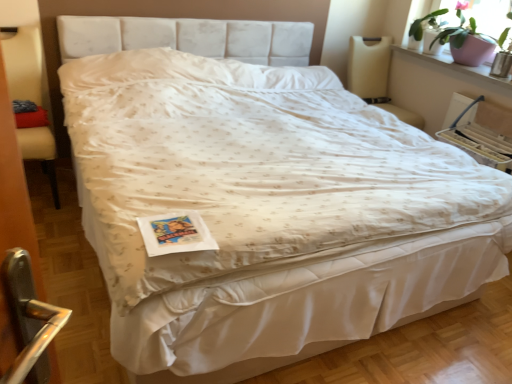
Question: Is green matte plant at upper right behind beige fabric armchair at left?

Choices:
 (A) no
 (B) yes

Answer: (B)

Question: Can you confirm if green matte plant at upper right is shorter than beige fabric armchair at left?

Choices:
 (A) no
 (B) yes

Answer: (B)

Question: Could beige fabric armchair at left be considered to be inside green matte plant at upper right?

Choices:
 (A) yes
 (B) no

Answer: (B)

Question: From a real-world perspective, is green matte plant at upper right located higher than beige fabric armchair at left?

Choices:
 (A) no
 (B) yes

Answer: (B)

Question: Can you confirm if green matte plant at upper right is positioned to the left of beige fabric armchair at left?

Choices:
 (A) yes
 (B) no

Answer: (B)

Question: Relative to pink ceramic pot at upper right, is beige fabric armchair at left in front or behind?

Choices:
 (A) behind
 (B) front

Answer: (B)

Question: From the image's perspective, is beige fabric armchair at left located above or below pink ceramic pot at upper right?

Choices:
 (A) below
 (B) above

Answer: (A)

Question: From a real-world perspective, relative to pink ceramic pot at upper right, is beige fabric armchair at left vertically above or below?

Choices:
 (A) above
 (B) below

Answer: (B)

Question: Is beige fabric armchair at left situated inside pink ceramic pot at upper right or outside?

Choices:
 (A) outside
 (B) inside

Answer: (A)

Question: Is pink ceramic pot at upper right spatially inside beige fabric armchair at left, or outside of it?

Choices:
 (A) inside
 (B) outside

Answer: (B)

Question: From a real-world perspective, relative to beige fabric armchair at left, is pink ceramic pot at upper right vertically above or below?

Choices:
 (A) above
 (B) below

Answer: (A)

Question: Is pink ceramic pot at upper right in front of or behind beige fabric armchair at left in the image?

Choices:
 (A) front
 (B) behind

Answer: (B)

Question: Considering the positions of pink ceramic pot at upper right and beige fabric armchair at left in the image, is pink ceramic pot at upper right taller or shorter than beige fabric armchair at left?

Choices:
 (A) short
 (B) tall

Answer: (A)

Question: From a real-world perspective, is green matte plant at upper right above or below pink ceramic pot at upper right?

Choices:
 (A) above
 (B) below

Answer: (A)

Question: Is point pyautogui.click(x=459, y=39) positioned closer to the camera than point pyautogui.click(x=459, y=69)?

Choices:
 (A) farther
 (B) closer

Answer: (A)